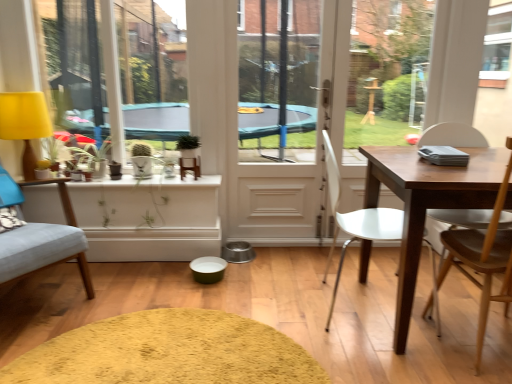
Find the location of a particular element. The image size is (512, 384). vacant space to the right of soft yellow rug at center is located at coordinates (362, 312).